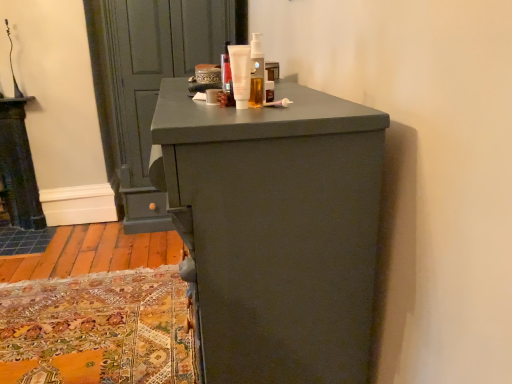
Question: Is translucent plastic bottle at upper center, which is the 3th toiletry from left to right, located within matte gray door at upper left?

Choices:
 (A) yes
 (B) no

Answer: (B)

Question: Is matte gray door at upper left to the left of translucent plastic bottle at upper center, which is the 3th toiletry from left to right, from the viewer's perspective?

Choices:
 (A) yes
 (B) no

Answer: (A)

Question: Could you tell me if matte gray door at upper left is facing translucent plastic bottle at upper center, which is the 1th toiletry from right to left?

Choices:
 (A) no
 (B) yes

Answer: (B)

Question: From the image's perspective, is matte gray door at upper left below translucent plastic bottle at upper center, which is the 1th toiletry from right to left?

Choices:
 (A) no
 (B) yes

Answer: (A)

Question: Does matte gray door at upper left have a lesser height compared to translucent plastic bottle at upper center, which is the 1th toiletry from right to left?

Choices:
 (A) no
 (B) yes

Answer: (A)

Question: Which is correct: white matte tube at center, acting as the 2th toiletry starting from the left, is inside translucent plastic bottle at upper center, which is the 1th toiletry from right to left, or outside of it?

Choices:
 (A) outside
 (B) inside

Answer: (A)

Question: Looking at their shapes, would you say white matte tube at center, acting as the 2th toiletry starting from the left, is wider or thinner than translucent plastic bottle at upper center, which is the 3th toiletry from left to right?

Choices:
 (A) wide
 (B) thin

Answer: (B)

Question: Is white matte tube at center, acting as the 2th toiletry starting from the left, taller or shorter than translucent plastic bottle at upper center, which is the 1th toiletry from right to left?

Choices:
 (A) tall
 (B) short

Answer: (B)

Question: From a real-world perspective, is white matte tube at center, acting as the 2th toiletry starting from the left, physically located above or below translucent plastic bottle at upper center, which is the 3th toiletry from left to right?

Choices:
 (A) above
 (B) below

Answer: (B)

Question: Does point (209, 91) appear closer or farther from the camera than point (260, 72)?

Choices:
 (A) closer
 (B) farther

Answer: (B)

Question: In the image, is matte white cream at center, placed as the 3th toiletry when sorted from right to left, on the left side or the right side of translucent plastic bottle at upper center, which is the 3th toiletry from left to right?

Choices:
 (A) left
 (B) right

Answer: (A)

Question: In terms of width, does matte white cream at center, placed as the 3th toiletry when sorted from right to left, look wider or thinner when compared to translucent plastic bottle at upper center, which is the 3th toiletry from left to right?

Choices:
 (A) thin
 (B) wide

Answer: (B)

Question: Would you say matte white cream at center, placed as the 3th toiletry when sorted from right to left, is inside or outside translucent plastic bottle at upper center, which is the 3th toiletry from left to right?

Choices:
 (A) outside
 (B) inside

Answer: (A)

Question: Would you say white matte tube at center, acting as the 2th toiletry starting from the left, is to the left or to the right of matte white cream at center, placed as the 3th toiletry when sorted from right to left, in the picture?

Choices:
 (A) left
 (B) right

Answer: (B)

Question: Is white matte tube at center, acting as the 2th toiletry starting from the left, wider or thinner than matte white cream at center, which is counted as the first toiletry, starting from the left?

Choices:
 (A) thin
 (B) wide

Answer: (A)